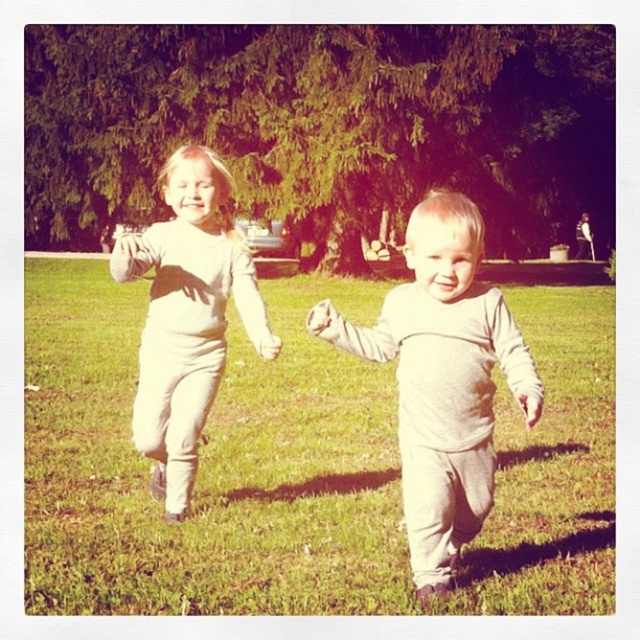
Question: Which object appears farthest from the camera in this image?

Choices:
 (A) green grass at center
 (B) gray cotton onesie at center

Answer: (A)

Question: Does green grass at center appear over white cotton shirt at upper left?

Choices:
 (A) yes
 (B) no

Answer: (B)

Question: Among these objects, which one is farthest from the camera?

Choices:
 (A) white cotton shirt at upper left
 (B) gray cotton onesie at center
 (C) green grass at center

Answer: (A)

Question: From the image, what is the correct spatial relationship of green grass at center in relation to white cotton shirt at upper left?

Choices:
 (A) below
 (B) above

Answer: (A)

Question: Which point appears closest to the camera in this image?

Choices:
 (A) (54, 262)
 (B) (323, 326)
 (C) (186, 298)

Answer: (B)

Question: Can you confirm if green grass at center is wider than gray cotton onesie at center?

Choices:
 (A) yes
 (B) no

Answer: (A)